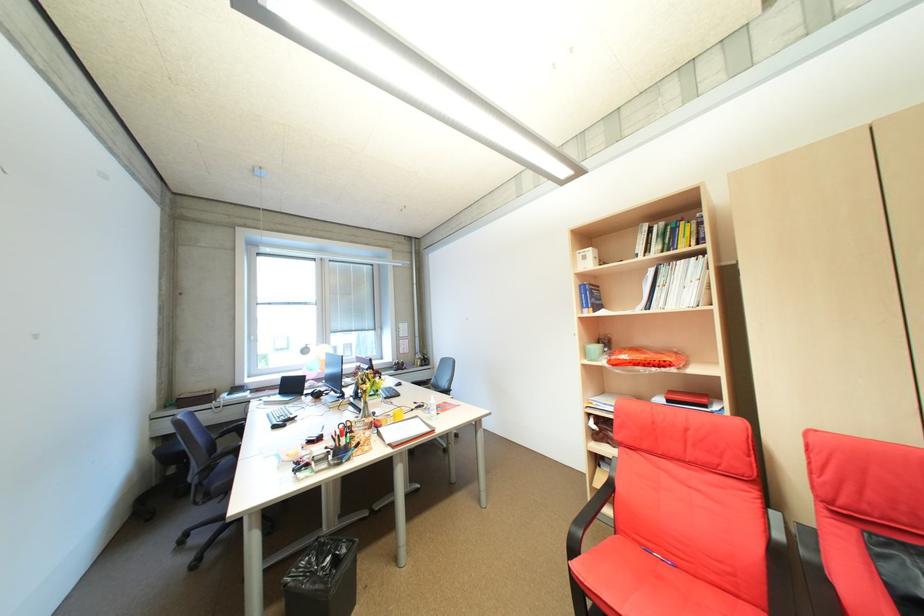
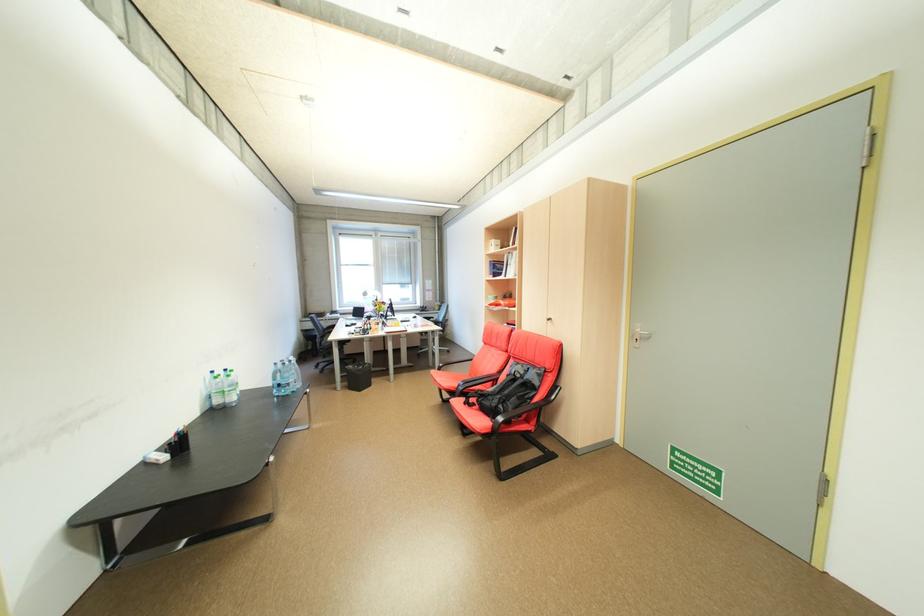
The images are taken continuously from a first-person perspective. In which direction are you moving?

The cameraman walked toward right, backward.